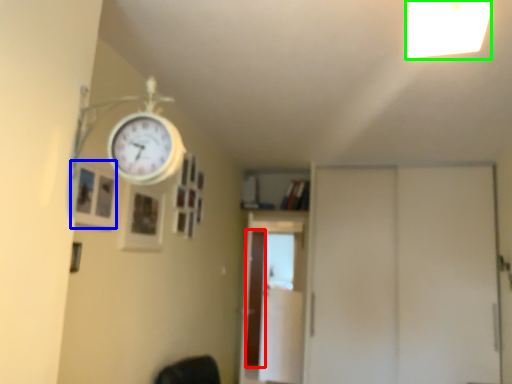
Question: Estimate the real-world distances between objects in this image. Which object is farther from screen door (highlighted by a red box), picture frame (highlighted by a blue box) or light fixture (highlighted by a green box)?

Choices:
 (A) picture frame
 (B) light fixture

Answer: (B)